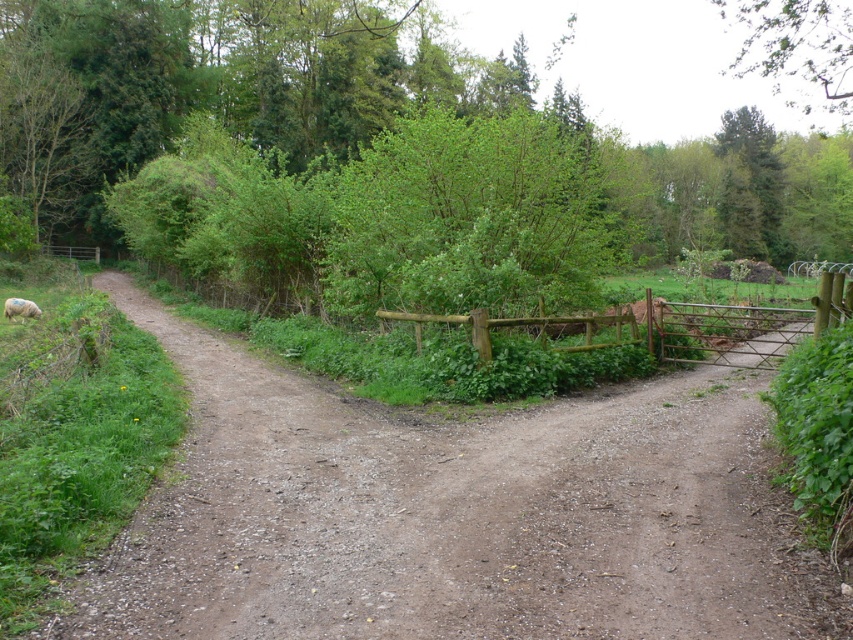
Does point (534, 477) lie behind point (805, 42)?

No, it is in front of (805, 42).

Between point (378, 493) and point (839, 3), which one is positioned in front?

Point (378, 493) is more forward.

Between point (434, 452) and point (805, 106), which one is positioned in front?

Point (434, 452) is more forward.

What are the coordinates of `brown gravel dirt track at center` in the screenshot? It's located at (453, 513).

Is brown gravel dirt track at center to the left of white woolly sheep at lower left from the viewer's perspective?

In fact, brown gravel dirt track at center is to the right of white woolly sheep at lower left.

Can you confirm if brown gravel dirt track at center is shorter than white woolly sheep at lower left?

No.

Measure the distance between point [206,435] and camera.

Point [206,435] and camera are 8.96 meters apart.

The width and height of the screenshot is (853, 640). What are the coordinates of `brown gravel dirt track at center` in the screenshot? It's located at (453, 513).

Between brown wooden fence at center and white woolly sheep at lower left, which one is positioned lower?

Positioned lower is white woolly sheep at lower left.

Identify the location of brown wooden fence at center. (743, 326).

Identify the location of brown wooden fence at center. (743, 326).